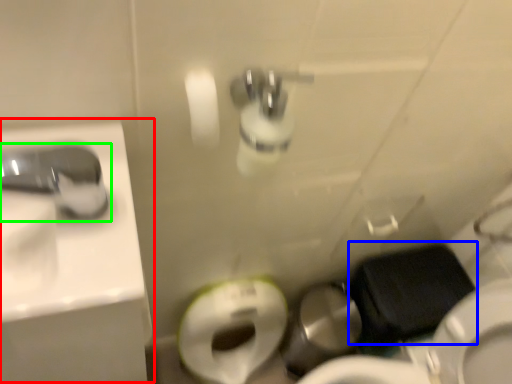
Question: Which object is positioned closest to sink (highlighted by a red box)? Select from sit (highlighted by a blue box) and tap (highlighted by a green box).

Choices:
 (A) sit
 (B) tap

Answer: (B)